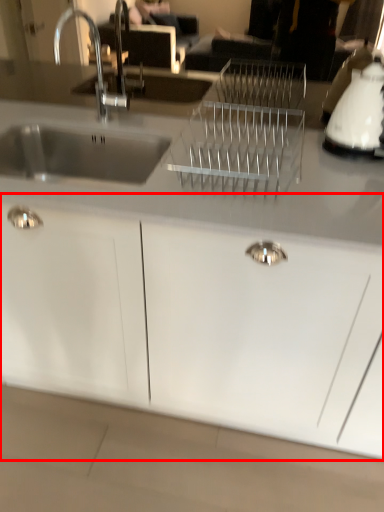
Question: From the image's perspective, where is cabinetry (annotated by the red box) located in relation to appliance in the image?

Choices:
 (A) above
 (B) below

Answer: (B)